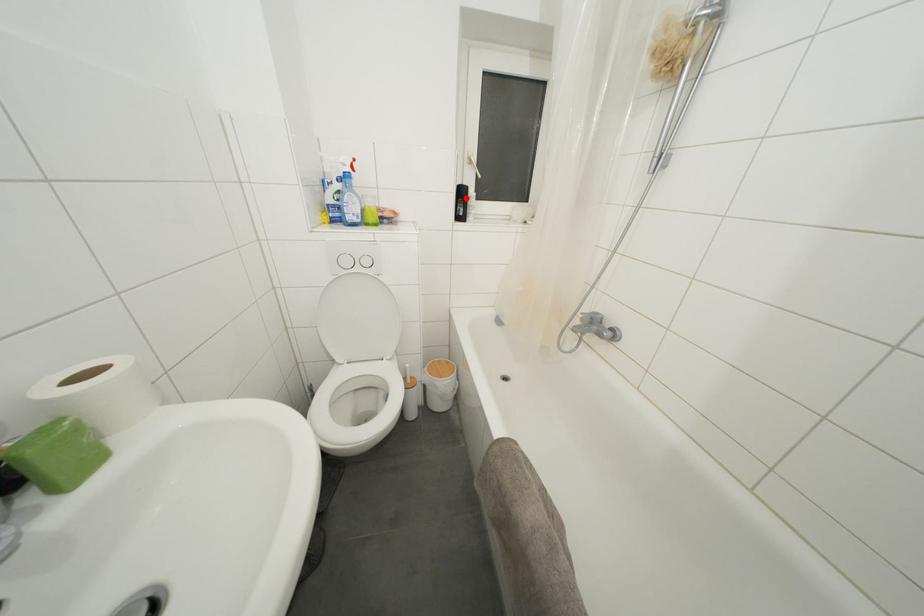
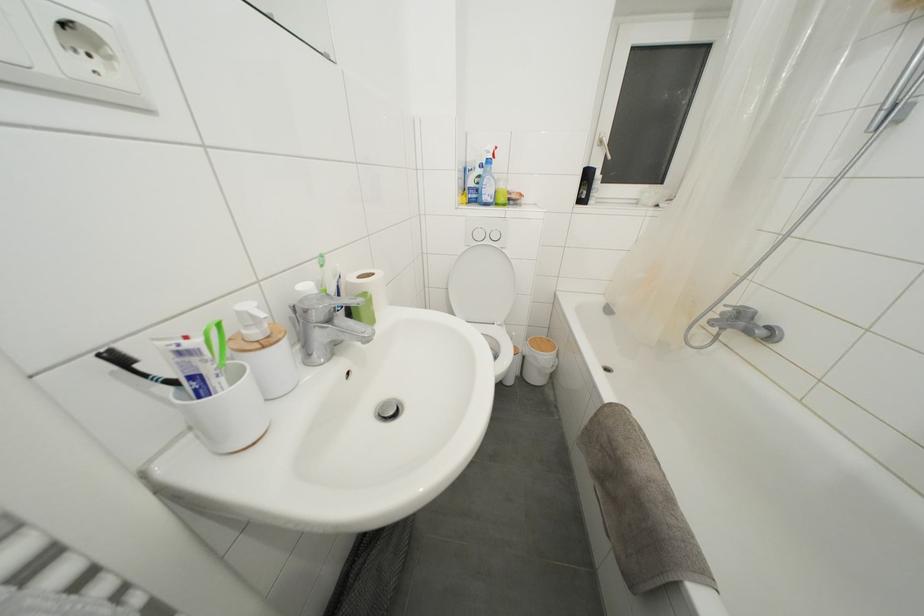
Where in the second image is the point corresponding to the highlighted location from the first image?

(591, 180)